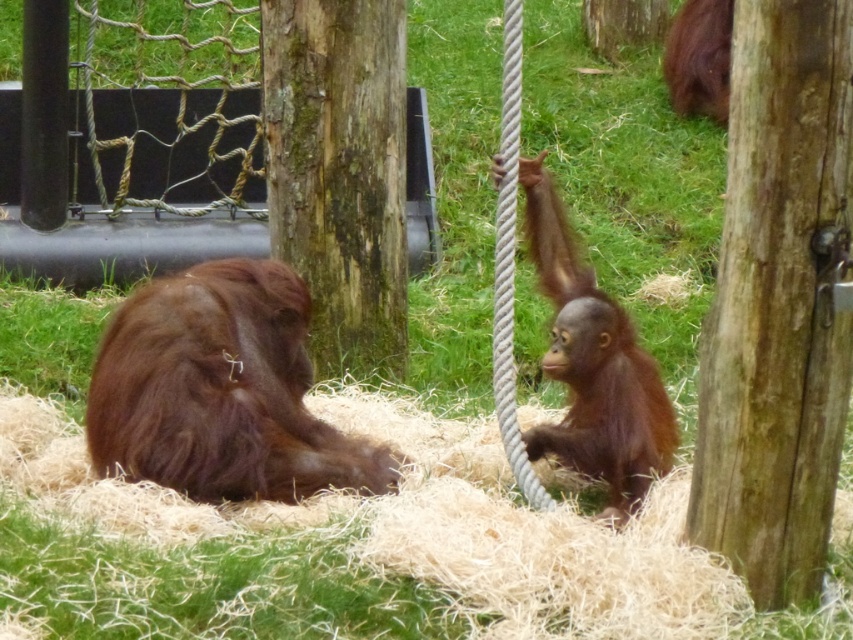
What do you see at coordinates (778, 304) in the screenshot?
I see `wooden post at center` at bounding box center [778, 304].

Is point (688, 538) closer to viewer compared to point (355, 97)?

Yes, it is.

Between point (705, 483) and point (354, 22), which one is positioned behind?

Point (354, 22)

You are a GUI agent. You are given a task and a screenshot of the screen. Output one action in this format:
    pyautogui.click(x=<x>, y=<y>)
    Task: Click on the wooden post at center
    
    Given the screenshot: What is the action you would take?
    pyautogui.click(x=778, y=304)

Between brown furry orangutan at left and brown furry orangutan at right, which one is positioned higher?

brown furry orangutan at right is above.

Can you confirm if brown furry orangutan at left is positioned to the left of brown furry orangutan at right?

Correct, you'll find brown furry orangutan at left to the left of brown furry orangutan at right.

At what (x,y) coordinates should I click in order to perform the action: click on brown furry orangutan at left. Please return your answer as a coordinate pair (x, y). Looking at the image, I should click on (221, 392).

Which is above, wooden post at center or brown furry orangutan at right?

Positioned higher is wooden post at center.

Is point (766, 282) positioned after point (633, 420)?

No, it is not.

Is point (834, 195) in front of point (581, 364)?

Yes, point (834, 195) is closer to viewer.

Locate an element on the screen. wooden post at center is located at coordinates (778, 304).